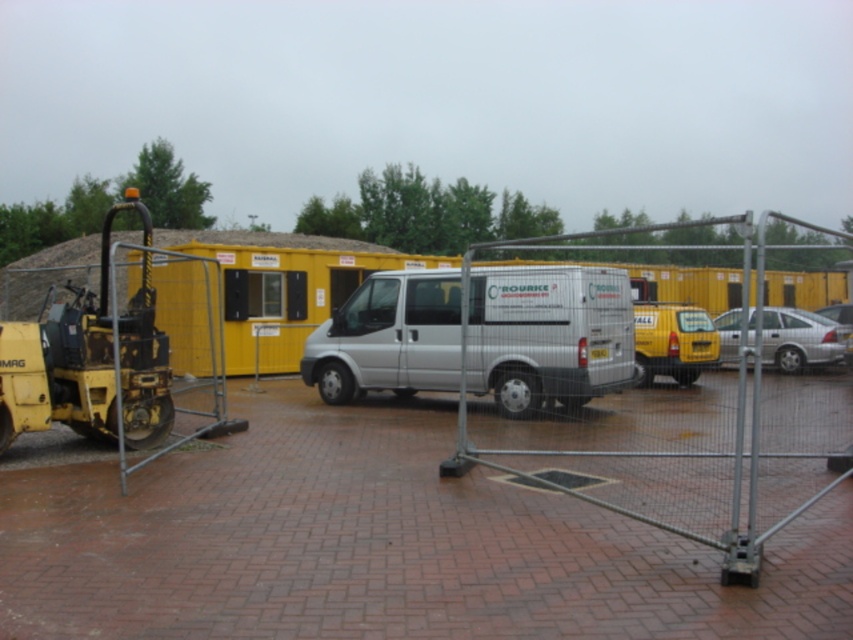
From the picture: Who is taller, silver metallic sedan at center or silver metallic car at right?

With more height is silver metallic car at right.

Can you confirm if silver metallic sedan at center is positioned to the left of silver metallic car at right?

Indeed, silver metallic sedan at center is positioned on the left side of silver metallic car at right.

Locate an element on the screen. silver metallic sedan at center is located at coordinates (799, 339).

Is silver metallic van at center thinner than silver metallic sedan at center?

No, silver metallic van at center is not thinner than silver metallic sedan at center.

Which of these two, silver metallic van at center or silver metallic sedan at center, stands taller?

silver metallic van at center is taller.

This screenshot has width=853, height=640. I want to click on silver metallic van at center, so click(548, 336).

Is yellow matte van at center above silver metallic sedan at center?

Incorrect, yellow matte van at center is not positioned above silver metallic sedan at center.

Between point (698, 337) and point (824, 326), which one is positioned in front?

Positioned in front is point (698, 337).

The width and height of the screenshot is (853, 640). Identify the location of yellow matte van at center. (672, 340).